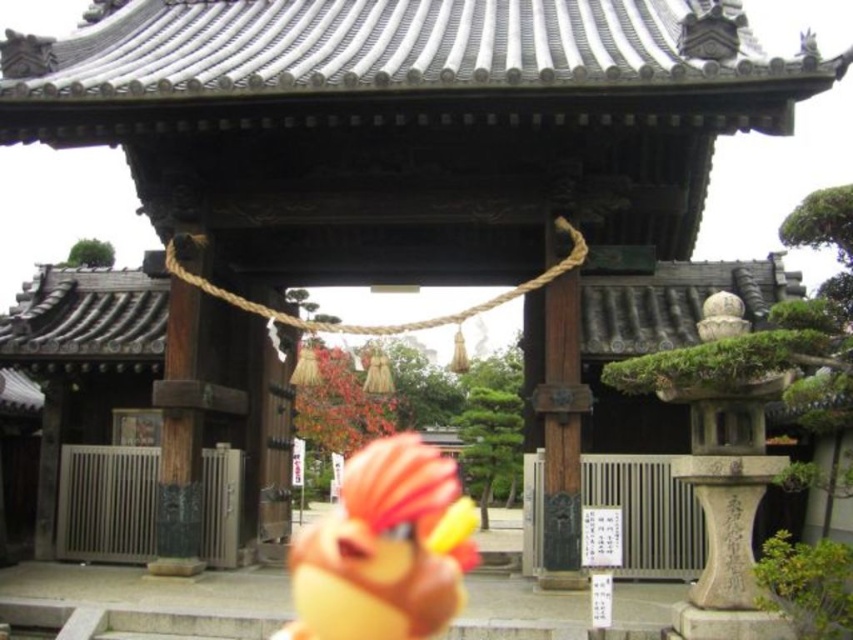
You are visiting a traditional Japanese shrine and notice the matte orange plush toy at center and the wooden post at center. Which object is closer to the ground?

The matte orange plush toy at center is positioned under the wooden post at center, so it is closer to the ground.

You are visiting a traditional Japanese shrine and see the matte orange plush toy at center and the wooden post at center. Which object is closer to you?

The matte orange plush toy at center is closer to you because it is in front of the wooden post at center.